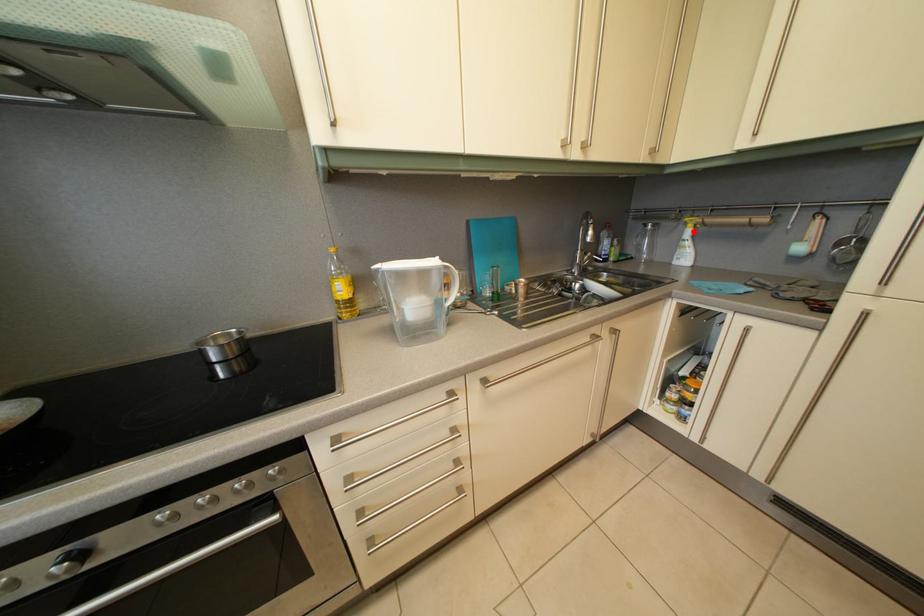
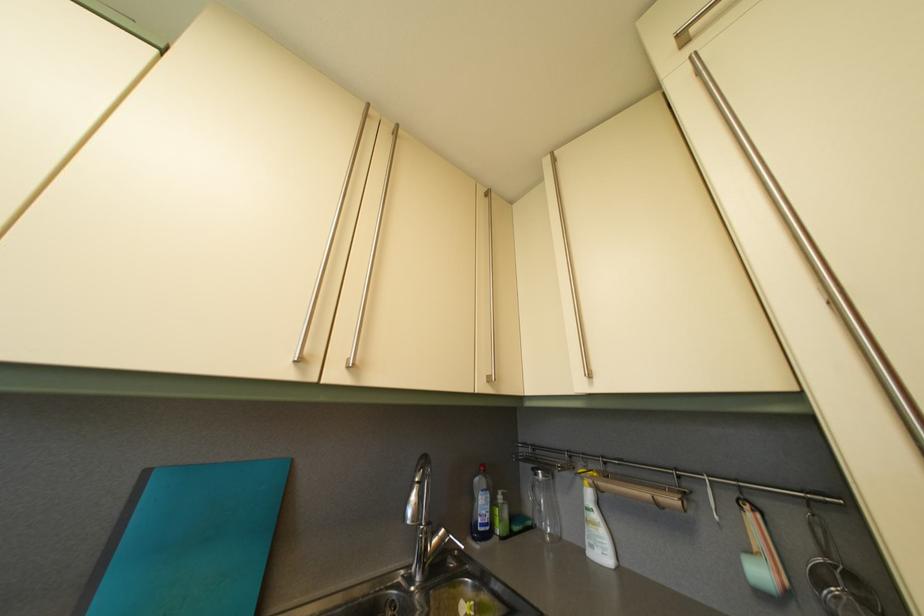
In the second image, find the point that corresponds to the highlighted location in the first image.

(590, 485)